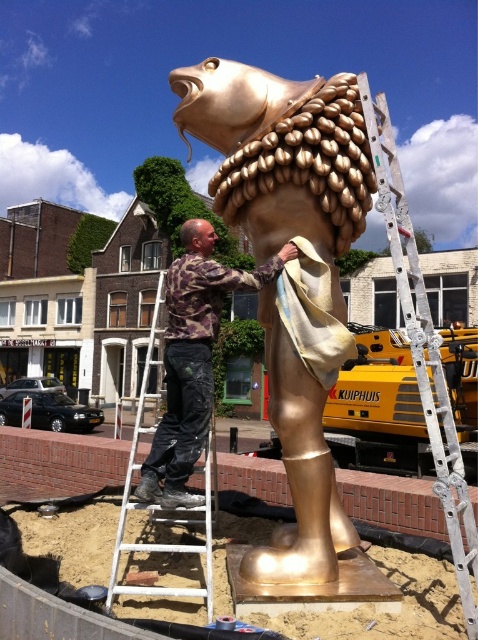
Question: Which point is closer to the camera taking this photo?

Choices:
 (A) (x=216, y=77)
 (B) (x=459, y=524)
 (C) (x=175, y=412)

Answer: (B)

Question: Is gold metallic fish at center positioned in front of camouflage fabric at center?

Choices:
 (A) yes
 (B) no

Answer: (A)

Question: Does camouflage fabric at center appear on the left side of white metallic ladder at center?

Choices:
 (A) yes
 (B) no

Answer: (A)

Question: Among these points, which one is farthest from the camera?

Choices:
 (A) (206, 531)
 (B) (270, 419)
 (C) (421, 397)

Answer: (C)

Question: Does camouflage fabric at center have a smaller size compared to white metal ladder at center?

Choices:
 (A) yes
 (B) no

Answer: (A)

Question: Which point is farther to the camera?

Choices:
 (A) (424, 356)
 (B) (273, 81)

Answer: (B)